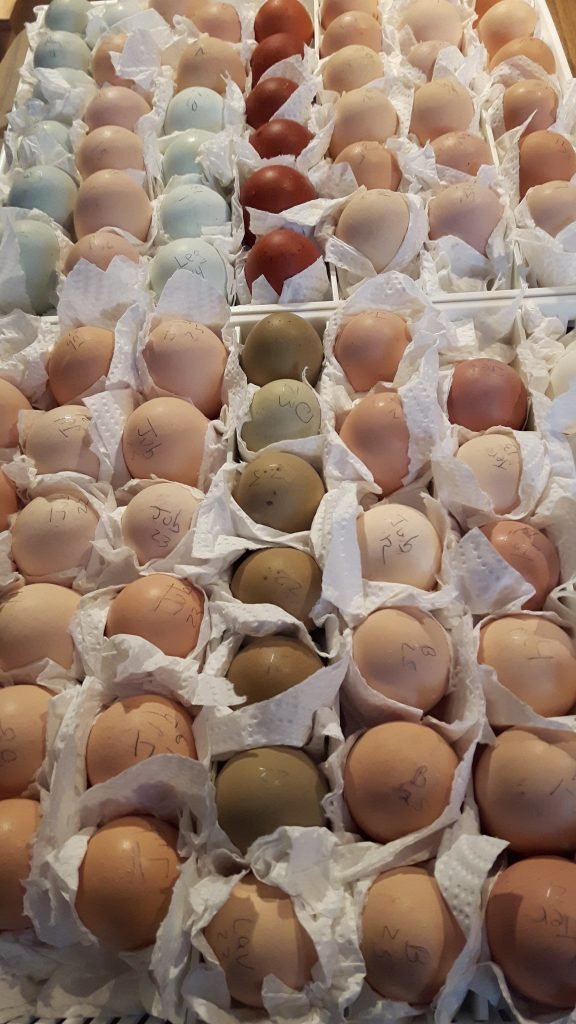
Identify the location of floor. (16, 19).